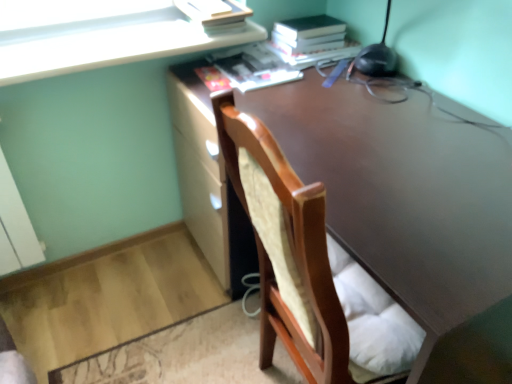
Identify the location of blank space situated above white glossy cabinet at upper left (from a real-world perspective). (104, 42).